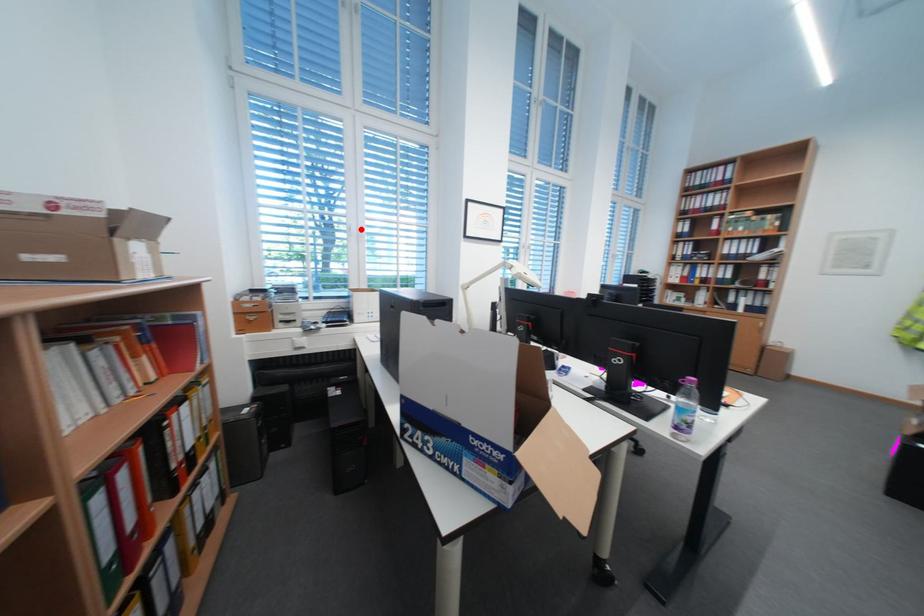
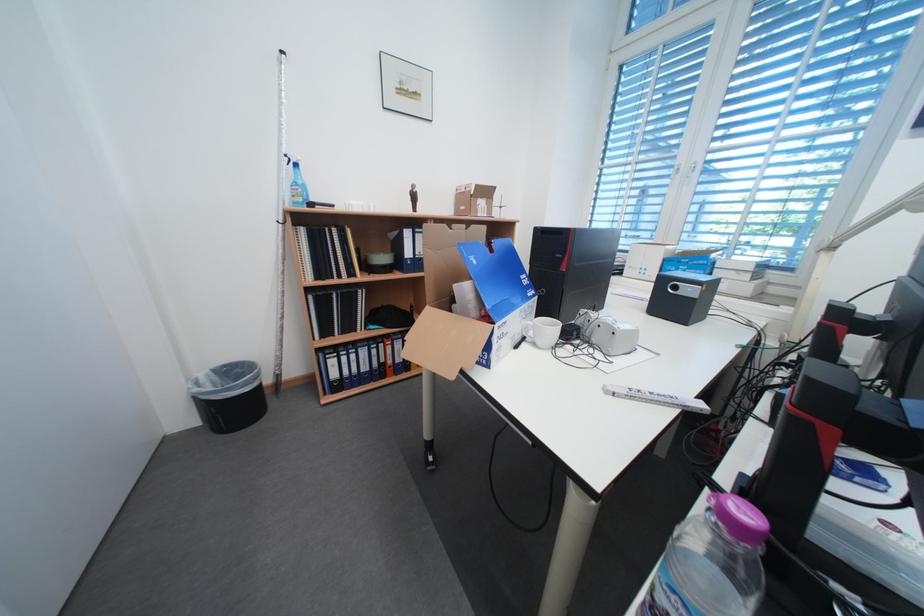
Locate, in the second image, the point that corresponds to the highlighted location in the first image.

(688, 171)